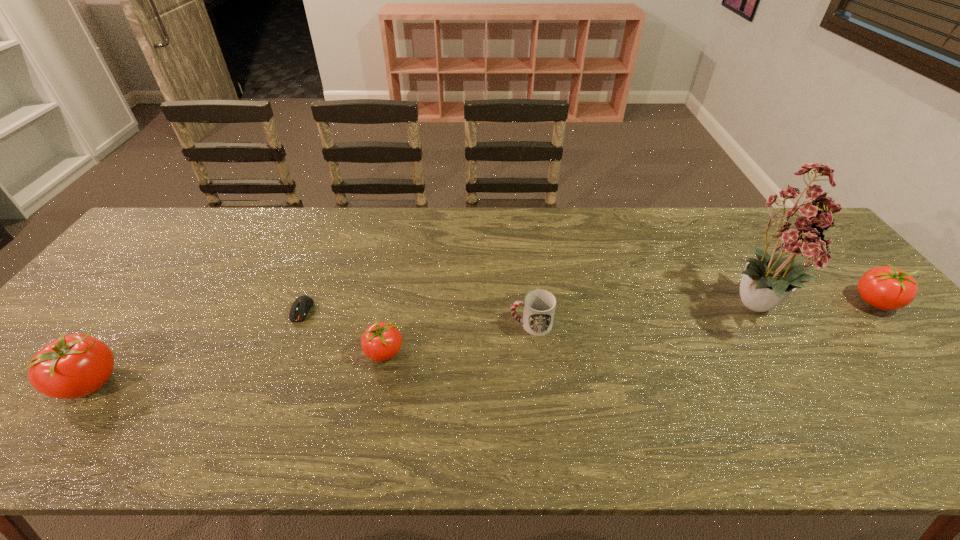
Find the location of `tomato that can be found as the third closest to the shortest object`. tomato that can be found as the third closest to the shortest object is located at coordinates (887, 288).

The height and width of the screenshot is (540, 960). What are the coordinates of `blank area in the image that satisfies the following two spatial constraints: 1. on the back side of the leftmost tomato; 2. on the right side of the third object from left to right` in the screenshot? It's located at (114, 353).

Locate an element on the screen. Image resolution: width=960 pixels, height=540 pixels. free space that satisfies the following two spatial constraints: 1. on the side of the cup where the handle is located; 2. on the right side of the third tallest object is located at coordinates (528, 302).